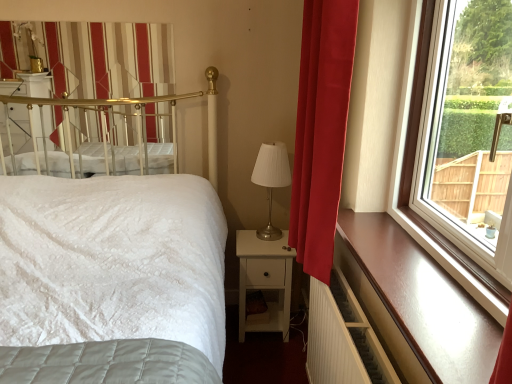
Where is `empty space that is ontop of white matte nightstand at center (from a real-world perspective)`? This screenshot has width=512, height=384. empty space that is ontop of white matte nightstand at center (from a real-world perspective) is located at coordinates (255, 239).